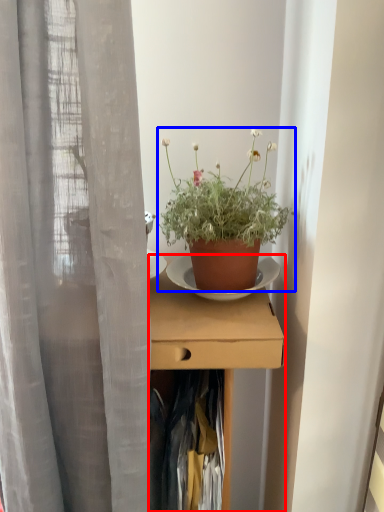
Question: Which of the following is the farthest to the observer, desk (highlighted by a red box) or houseplant (highlighted by a blue box)?

Choices:
 (A) desk
 (B) houseplant

Answer: (B)